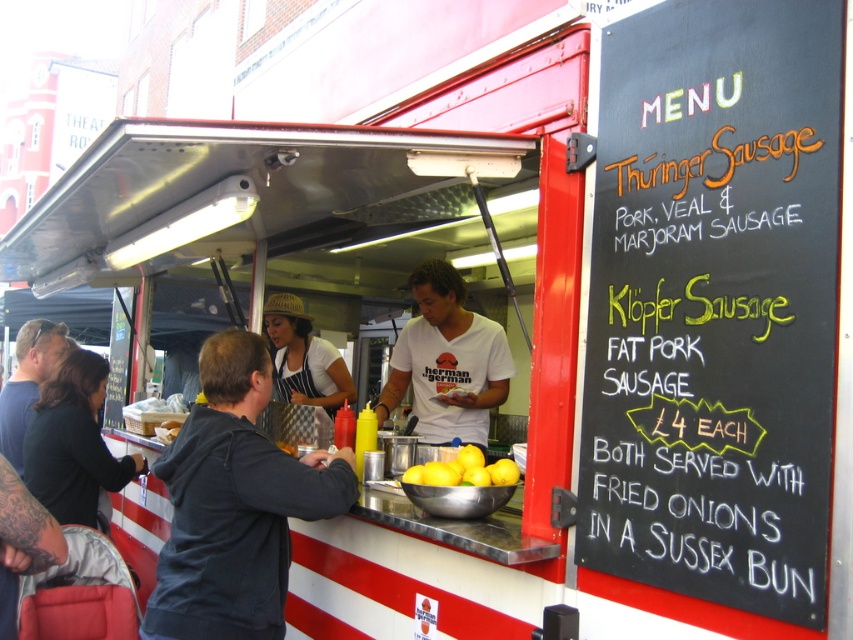
Between point (467, 401) and point (138, 458), which one is positioned behind?

Point (138, 458)

Who is positioned more to the right, white cotton shirt at center or dark gray sweater at lower left?

white cotton shirt at center is more to the right.

Does point (486, 358) come behind point (78, 516)?

Yes, it is behind point (78, 516).

What are the coordinates of `white cotton shirt at center` in the screenshot? It's located at (447, 362).

Between black chalkboard menu at right and yellow matte lemons at center, which one is positioned lower?

Positioned lower is yellow matte lemons at center.

Which is more to the right, black chalkboard menu at right or yellow matte lemons at center?

From the viewer's perspective, black chalkboard menu at right appears more on the right side.

Does point (816, 445) come farther from viewer compared to point (479, 483)?

No, (816, 445) is closer to viewer.

The height and width of the screenshot is (640, 853). Find the location of `black chalkboard menu at right`. black chalkboard menu at right is located at coordinates (715, 304).

Between dark gray hoodie at center and yellow matte lemons at center, which one has more height?

Standing taller between the two is dark gray hoodie at center.

In the scene shown: Does dark gray hoodie at center have a greater width compared to yellow matte lemons at center?

Yes, dark gray hoodie at center is wider than yellow matte lemons at center.

Between point (250, 458) and point (479, 458), which one is positioned behind?

Point (479, 458)

Where is `dark gray hoodie at center`? The height and width of the screenshot is (640, 853). dark gray hoodie at center is located at coordinates (235, 504).